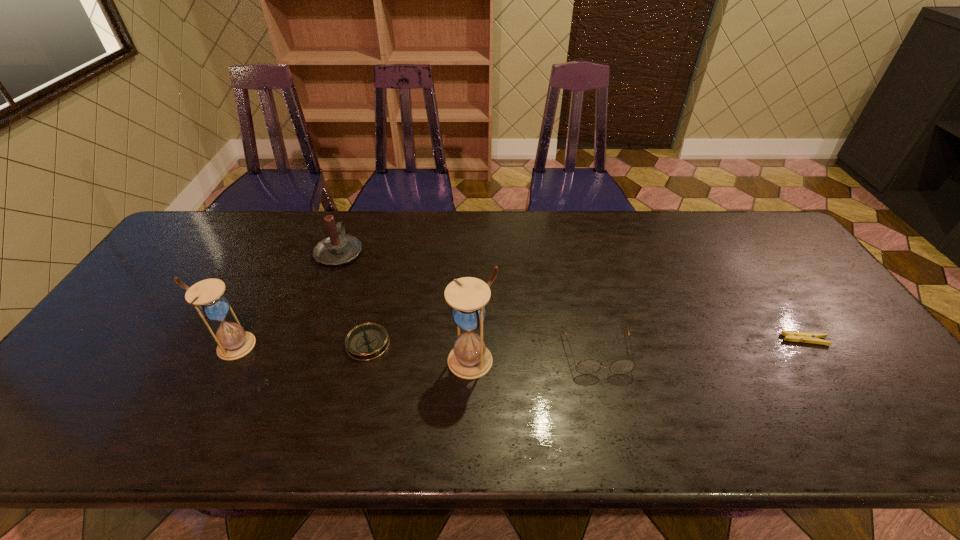
The width and height of the screenshot is (960, 540). Find the location of `the shorter hourglass`. the shorter hourglass is located at coordinates (207, 296).

Find the location of a particular element. the fifth shortest object is located at coordinates (207, 296).

Identify the location of the tallest object. (469, 359).

The image size is (960, 540). Find the location of `the third object from right to left`. the third object from right to left is located at coordinates point(469,359).

What are the coordinates of `candle` in the screenshot? It's located at (338, 249).

Image resolution: width=960 pixels, height=540 pixels. I want to click on the fourth shortest object, so click(338, 249).

Locate an element on the screen. The width and height of the screenshot is (960, 540). the fifth tallest object is located at coordinates (367, 341).

Where is `the fourth object from right to left`? the fourth object from right to left is located at coordinates (367, 341).

Identify the location of clothespin. Image resolution: width=960 pixels, height=540 pixels. (806, 337).

The width and height of the screenshot is (960, 540). What are the coordinates of `the shortest object` in the screenshot? It's located at tap(806, 337).